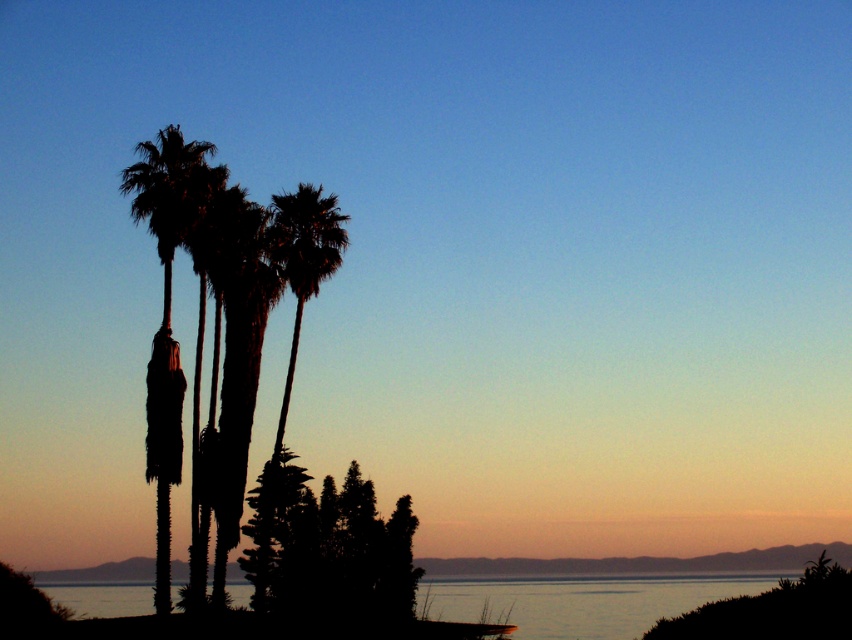
Question: Can you confirm if transparent water at lower center is positioned to the right of smooth sand at center?

Choices:
 (A) yes
 (B) no

Answer: (B)

Question: Estimate the real-world distances between objects in this image. Which object is closer to the transparent water at lower center?

Choices:
 (A) silhouette leafy palm at left
 (B) smooth sand at center
 (C) silhouette palm tree at center
 (D) silhouette leafy tree at center

Answer: (B)

Question: Which object is farther from the camera taking this photo?

Choices:
 (A) silhouette leafy palm at left
 (B) silhouette palm tree at center
 (C) transparent water at lower center

Answer: (B)

Question: Does transparent water at lower center come behind silhouette leafy palm at left?

Choices:
 (A) yes
 (B) no

Answer: (B)

Question: Can you confirm if transparent water at lower center is bigger than smooth sand at center?

Choices:
 (A) no
 (B) yes

Answer: (B)

Question: Which object is farther from the camera taking this photo?

Choices:
 (A) transparent water at lower center
 (B) smooth sand at center
 (C) silhouette leafy tree at center
 (D) silhouette palm tree at center

Answer: (B)